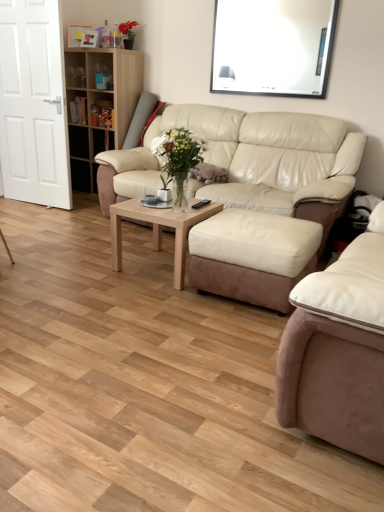
Where is `vacant area on top of light brown wood coffee table at center (from a real-world perspective)`? Image resolution: width=384 pixels, height=512 pixels. vacant area on top of light brown wood coffee table at center (from a real-world perspective) is located at coordinates (172, 205).